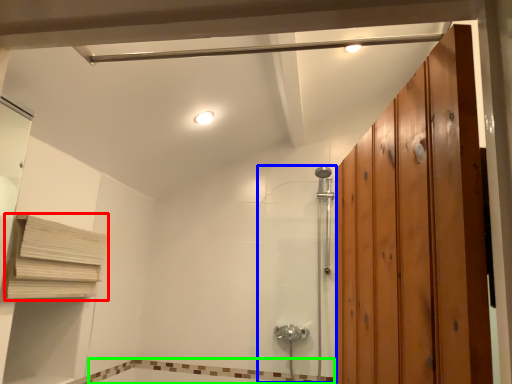
Question: Based on their relative distances, which object is nearer to shelf (highlighted by a red box)? Choose from shower door (highlighted by a blue box) and bath (highlighted by a green box).

Choices:
 (A) shower door
 (B) bath

Answer: (B)